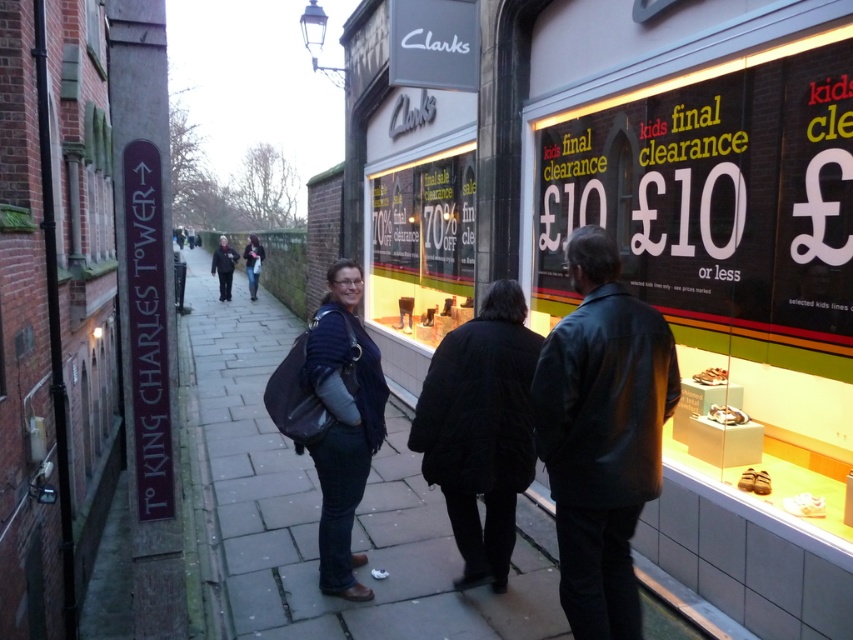
You are standing on the paved stone sidewalk at center and want to place the dark blue denim jacket at center on a rack that requires the item to be taller than the sidewalk. Will the jacket meet the height requirement?

The dark blue denim jacket at center is taller than the paved stone sidewalk at center, so it will meet the height requirement.